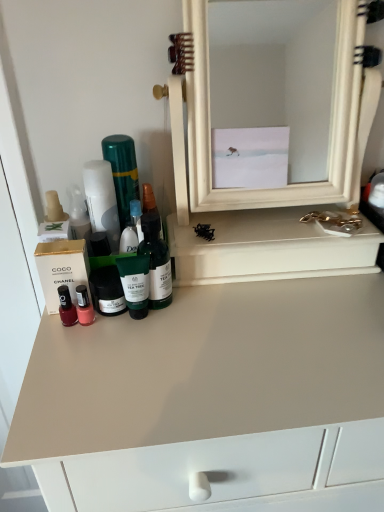
Measure the distance between point (117,206) and camera.

Point (117,206) is 29.49 inches from camera.

Locate an element on the screen. This screenshot has width=384, height=512. white glossy mouthwash at left is located at coordinates (111, 188).

The height and width of the screenshot is (512, 384). Describe the element at coordinates (111, 188) in the screenshot. I see `white glossy mouthwash at left` at that location.

Locate an element on the screen. The width and height of the screenshot is (384, 512). white glossy mouthwash at left is located at coordinates (111, 188).